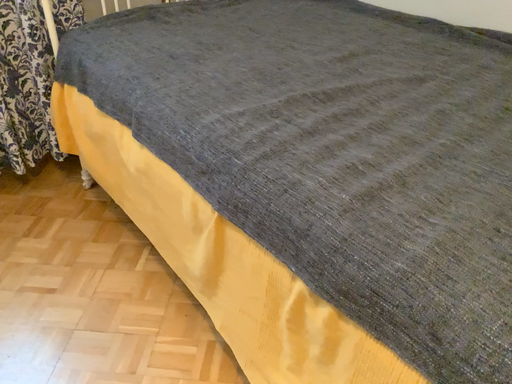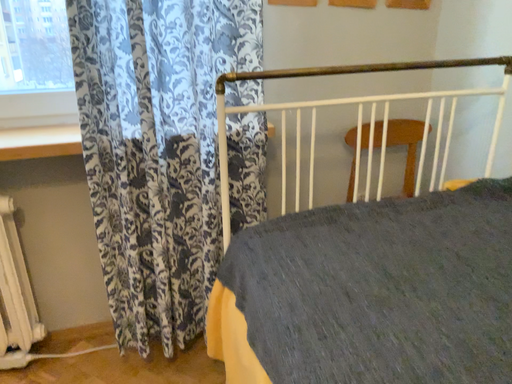
Question: Which way did the camera rotate in the video?

Choices:
 (A) rotated upward
 (B) rotated downward

Answer: (A)